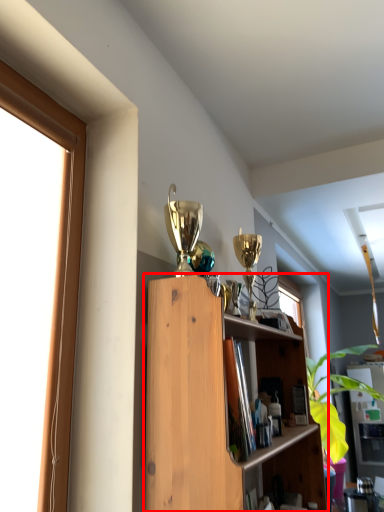
Question: In this image, where is shelf (annotated by the red box) located relative to cabinet?

Choices:
 (A) right
 (B) left

Answer: (B)